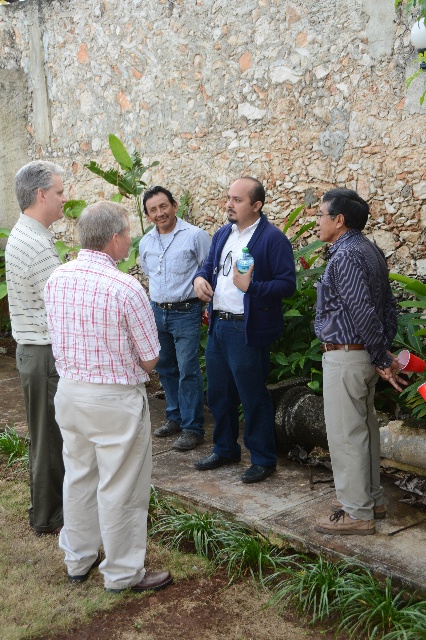
Which is below, patterned fabric shirt at lower right or blue denim jeans at center?

Positioned lower is patterned fabric shirt at lower right.

In the scene shown: Does patterned fabric shirt at lower right appear over blue denim jeans at center?

No, patterned fabric shirt at lower right is not above blue denim jeans at center.

Based on the photo, who is more distant from viewer, (336, 246) or (173, 360)?

The point (173, 360) is more distant.

This screenshot has width=426, height=640. In order to click on patterned fabric shirt at lower right in this screenshot , I will do `click(353, 358)`.

Which is more to the left, green leafy plant at center or green leafy plant at right?

Positioned to the left is green leafy plant at center.

Who is more distant from viewer, [275,364] or [417,282]?

Positioned behind is point [275,364].

The image size is (426, 640). Identify the location of green leafy plant at center. [x=299, y=323].

Which is below, blue fabric jacket at center or striped sweater at left?

striped sweater at left is below.

Who is shorter, blue fabric jacket at center or striped sweater at left?

blue fabric jacket at center

Between point (279, 252) and point (31, 445), which one is positioned in front?

Point (31, 445) is more forward.

Where is `blue fabric jacket at center`? The width and height of the screenshot is (426, 640). blue fabric jacket at center is located at coordinates 244,326.